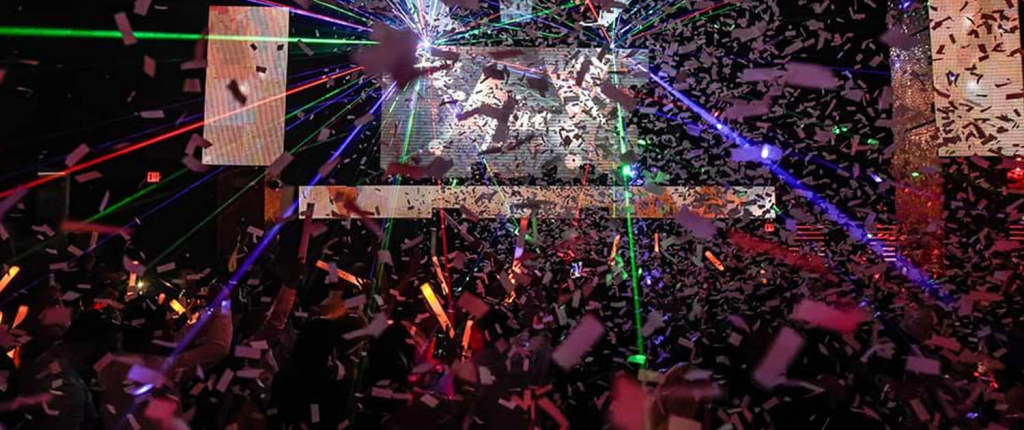
Identify the location of exit sign. (145, 175).